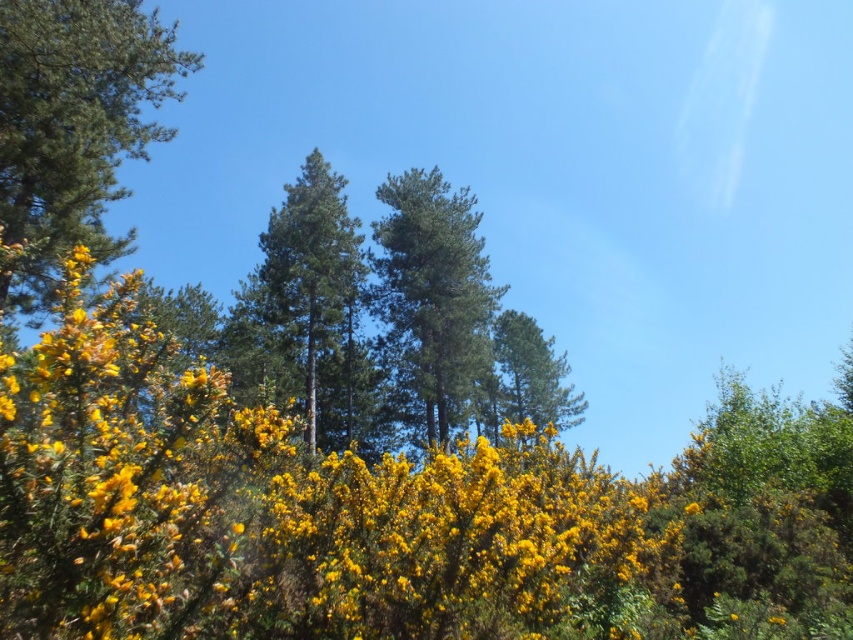
You are standing in the vibrant natural scene described. You notice a point marked at coordinates (73, 125). What does this point indicate?

The point at coordinates (73, 125) marks the location of green needle like at upper left.

You are standing in the vibrant natural scene described. There is a point marked at coordinates (x=387, y=513). What object in the scene corresponds to this point?

The point at coordinates (x=387, y=513) corresponds to the yellow fluffy bush at center.